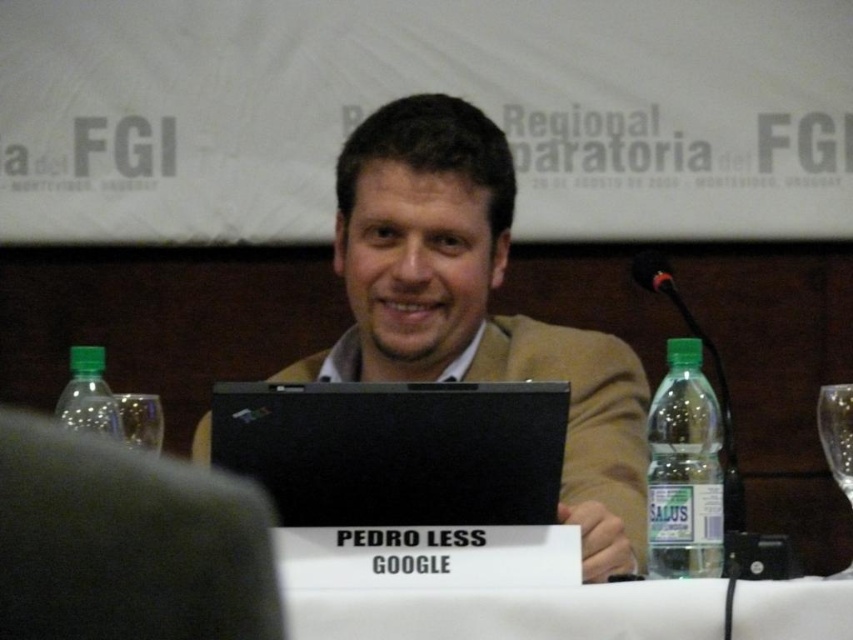
Question: Does black matte laptop at center have a lesser width compared to green plastic bottle at left?

Choices:
 (A) yes
 (B) no

Answer: (B)

Question: Among these objects, which one is nearest to the camera?

Choices:
 (A) clear plastic bottle at right
 (B) black matte laptop at center

Answer: (B)

Question: Is matte black laptop at center further to the viewer compared to gray fabric at lower left?

Choices:
 (A) no
 (B) yes

Answer: (B)

Question: Which point is farther from the camera taking this photo?

Choices:
 (A) (608, 602)
 (B) (171, 518)
 (C) (368, 129)

Answer: (C)

Question: Among these points, which one is nearest to the camera?

Choices:
 (A) (578, 376)
 (B) (247, 516)

Answer: (B)

Question: Can you confirm if gray fabric at lower left is positioned to the right of clear plastic bottle at right?

Choices:
 (A) yes
 (B) no

Answer: (B)